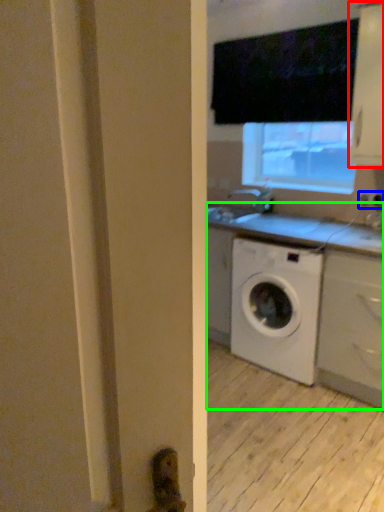
Question: Considering the real-world distances, which object is closest to cabinetry (highlighted by a red box)? electric outlet (highlighted by a blue box) or counter (highlighted by a green box).

Choices:
 (A) electric outlet
 (B) counter

Answer: (A)